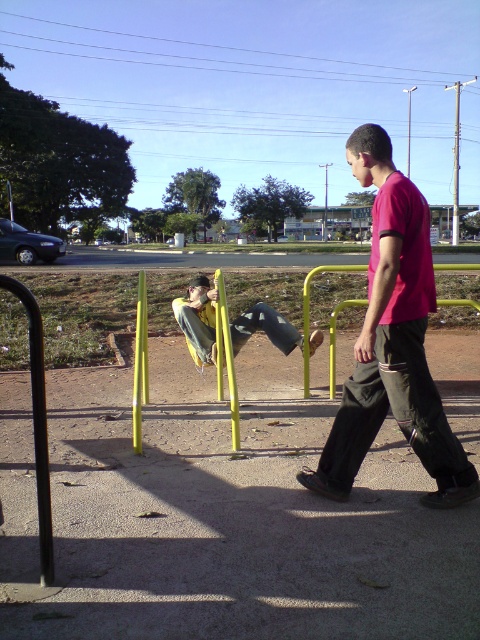
You are a photographer trying to capture both the pink matte shirt at center and the yellow fabric pants at center in a single frame. Considering their sizes, which object should you focus on first to ensure both are in the frame?

The pink matte shirt at center is larger than the yellow fabric pants at center, so you should focus on the pink matte shirt at center first to ensure both are in the frame.

You are a photographer trying to capture both the pink matte shirt at center and the yellow fabric pants at center in a single frame. Based on their sizes, which one will appear larger in the photo?

The pink matte shirt at center will appear larger in the photo since it is much taller than the yellow fabric pants at center.